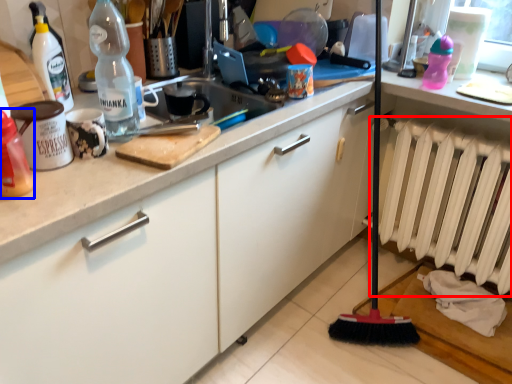
Question: Among these objects, which one is farthest to the camera, radiator (highlighted by a red box) or bottle (highlighted by a blue box)?

Choices:
 (A) radiator
 (B) bottle

Answer: (A)